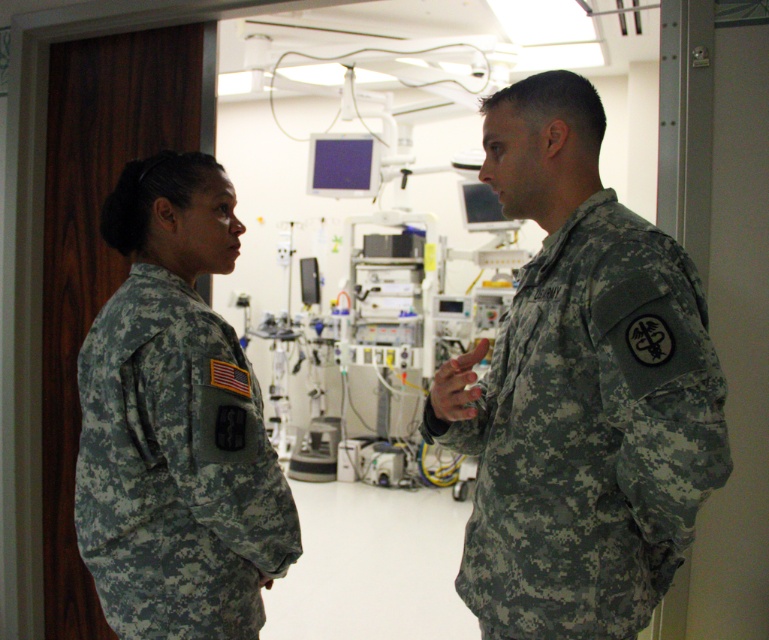
How far apart are camouflage uniform at right and camouflage uniform at left?

A distance of 47.70 centimeters exists between camouflage uniform at right and camouflage uniform at left.

Does point (648, 342) come behind point (195, 460)?

No, it is not.

Is point (581, 474) behind point (235, 236)?

No, it is not.

Find the location of a particular element. The image size is (769, 640). camouflage uniform at right is located at coordinates (578, 392).

Is camouflage uniform at right closer to the viewer compared to camouflage fabric monitor at center?

Yes, it is in front of camouflage fabric monitor at center.

Between camouflage uniform at right and camouflage fabric monitor at center, which one is positioned higher?

camouflage fabric monitor at center is above.

The height and width of the screenshot is (640, 769). What are the coordinates of `camouflage uniform at right` in the screenshot? It's located at (578, 392).

Does camouflage uniform at left have a lesser width compared to camouflage fabric monitor at center?

Yes.

Who is lower down, camouflage uniform at left or camouflage fabric monitor at center?

camouflage uniform at left is lower down.

I want to click on camouflage uniform at left, so click(175, 422).